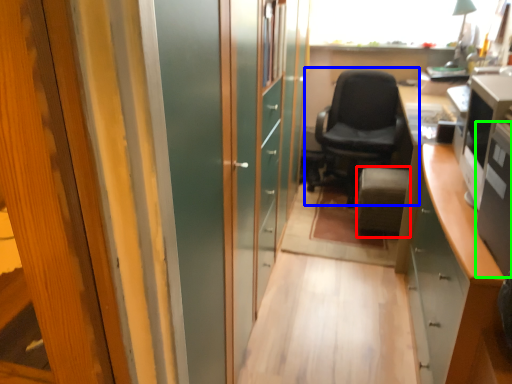
Question: Which is farther away from furniture (highlighted by a red box)? chair (highlighted by a blue box) or desktop computer (highlighted by a green box)?

Choices:
 (A) chair
 (B) desktop computer

Answer: (B)